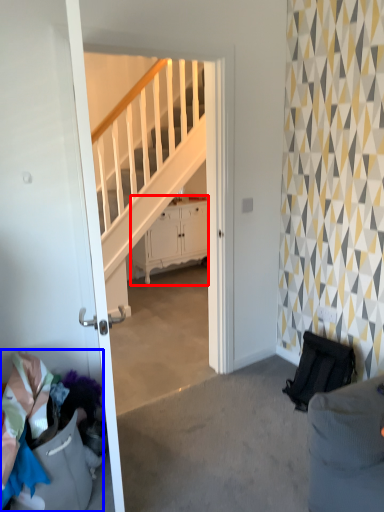
Question: Which of the following is the closest to the observer, cabinetry (highlighted by a red box) or laundry (highlighted by a blue box)?

Choices:
 (A) cabinetry
 (B) laundry

Answer: (B)